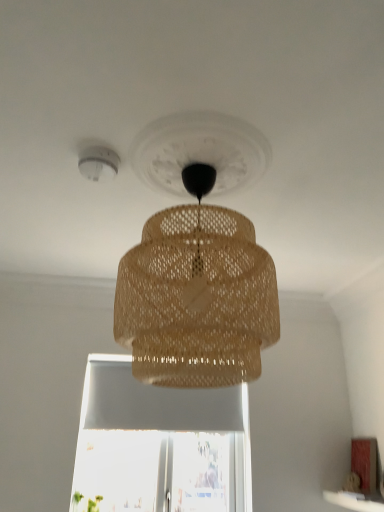
Question: Considering the relative sizes of white plastic smoke detector at upper left and white matte window sill at lower right in the image provided, is white plastic smoke detector at upper left wider than white matte window sill at lower right?

Choices:
 (A) no
 (B) yes

Answer: (A)

Question: Considering the relative positions of white plastic smoke detector at upper left and white matte window sill at lower right in the image provided, is white plastic smoke detector at upper left to the right of white matte window sill at lower right from the viewer's perspective?

Choices:
 (A) no
 (B) yes

Answer: (A)

Question: Is white plastic smoke detector at upper left aimed at white matte window sill at lower right?

Choices:
 (A) yes
 (B) no

Answer: (B)

Question: Can you confirm if white plastic smoke detector at upper left is taller than white matte window sill at lower right?

Choices:
 (A) no
 (B) yes

Answer: (B)

Question: Does white plastic smoke detector at upper left have a larger size compared to white matte window sill at lower right?

Choices:
 (A) no
 (B) yes

Answer: (A)

Question: Is the surface of white plastic smoke detector at upper left in direct contact with white matte window sill at lower right?

Choices:
 (A) yes
 (B) no

Answer: (B)

Question: Is white plastic smoke detector at upper left inside brown woven lampshade at center?

Choices:
 (A) yes
 (B) no

Answer: (B)

Question: Is brown woven lampshade at center to the right of white plastic smoke detector at upper left from the viewer's perspective?

Choices:
 (A) no
 (B) yes

Answer: (B)

Question: Is brown woven lampshade at center bigger than white plastic smoke detector at upper left?

Choices:
 (A) no
 (B) yes

Answer: (B)

Question: Is brown woven lampshade at center not close to white plastic smoke detector at upper left?

Choices:
 (A) no
 (B) yes

Answer: (A)

Question: Considering the relative sizes of brown woven lampshade at center and white plastic smoke detector at upper left in the image provided, is brown woven lampshade at center smaller than white plastic smoke detector at upper left?

Choices:
 (A) no
 (B) yes

Answer: (A)

Question: Is brown woven lampshade at center outside of white plastic smoke detector at upper left?

Choices:
 (A) no
 (B) yes

Answer: (B)

Question: Is white matte window sill at lower right at the left side of brown woven lampshade at center?

Choices:
 (A) yes
 (B) no

Answer: (B)